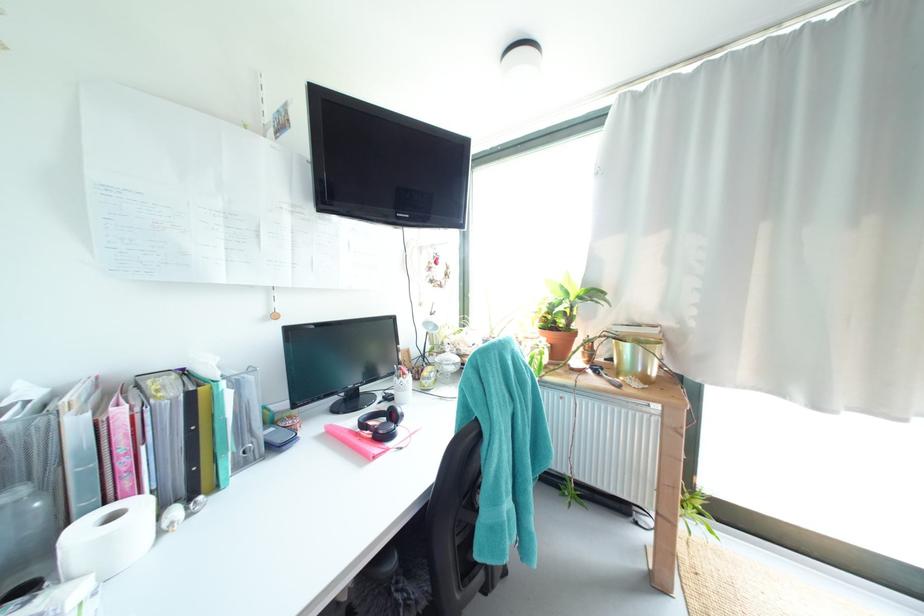
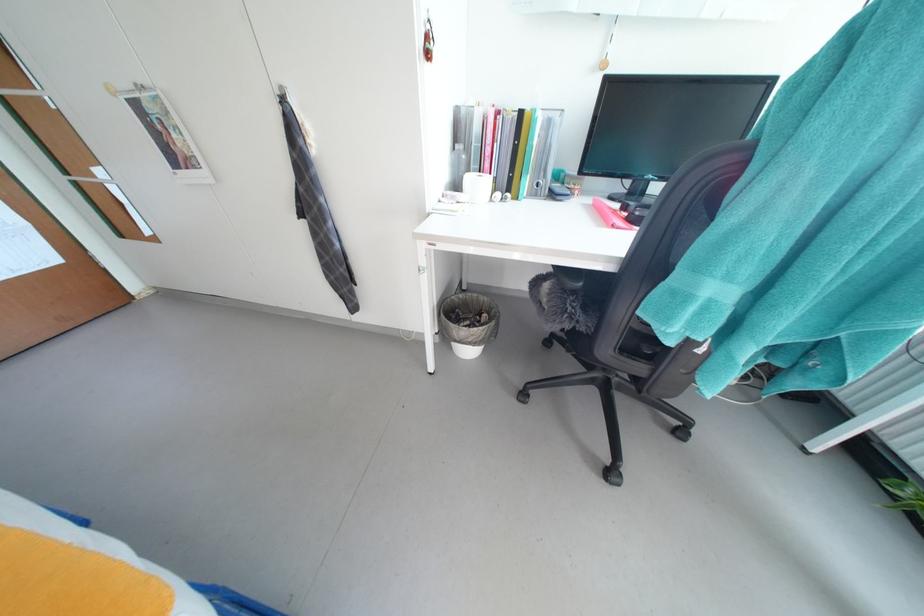
Find the pixel in the second image that matches pixel 331 432 in the first image.

(599, 204)